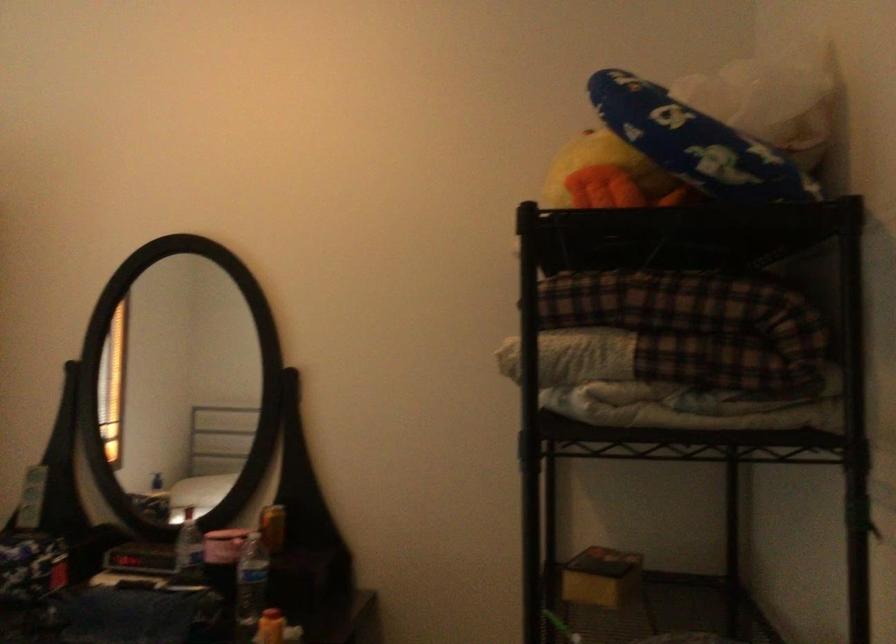
You are a GUI agent. You are given a task and a screenshot of the screen. Output one action in this format:
    pyautogui.click(x=<x>, y=<y>)
    Task: Click on the white plastic bag
    The image size is (896, 644).
    Given the screenshot: What is the action you would take?
    pyautogui.click(x=768, y=104)